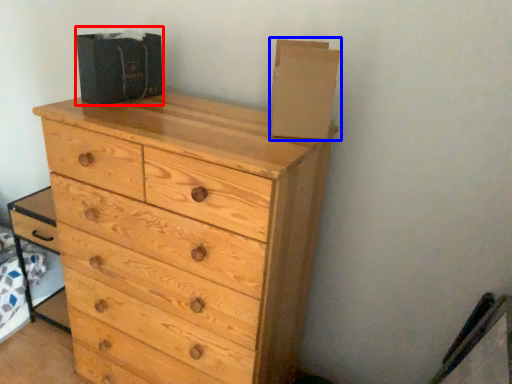
Question: Which object appears closest to the camera in this image, cardboard box (highlighted by a red box) or cardboard box (highlighted by a blue box)?

Choices:
 (A) cardboard box
 (B) cardboard box

Answer: (B)